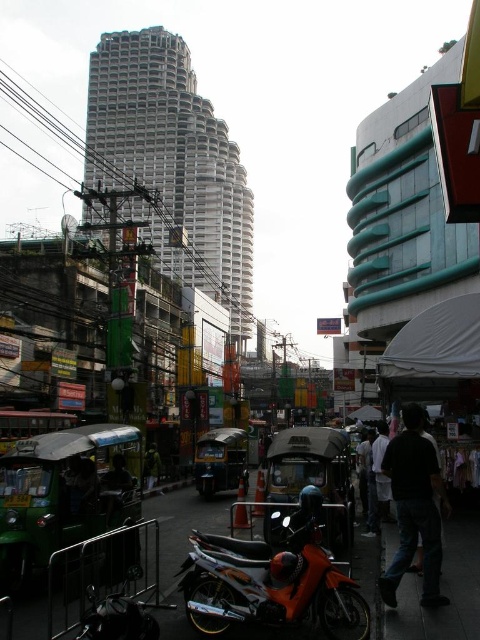
You are a delivery person standing at the edge of the street. You need to deliver a package to a customer who is wearing dark matte clothing at lower right. There is an orange matte motorcycle at lower center blocking your path. Can you walk around the motorcycle to reach the customer?

The orange matte motorcycle at lower center is in front of the dark matte clothing at lower right, so you can walk around the motorcycle to reach the customer.